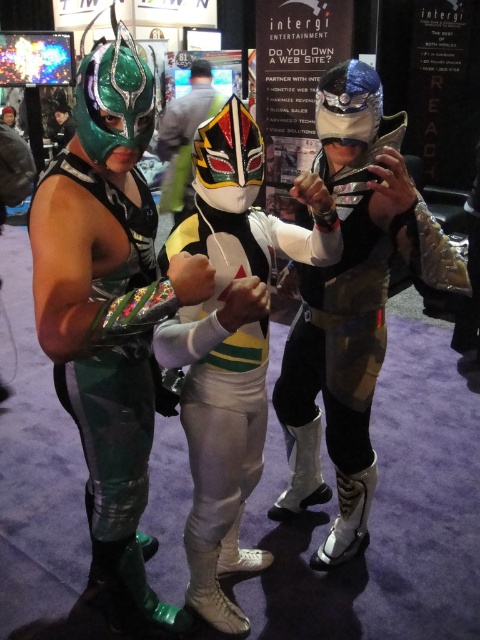
Does point (328, 93) come farther from viewer compared to point (211, 605)?

No, it is not.

Can you confirm if shiny silver armor at center is positioned to the left of white matte costume at center?

No, shiny silver armor at center is not to the left of white matte costume at center.

Is point (370, 228) in front of point (251, 173)?

No, (370, 228) is further to viewer.

This screenshot has width=480, height=640. In order to click on shiny silver armor at center in this screenshot , I will do `click(351, 304)`.

Can you confirm if green shiny suit at left is positioned below white glossy mask at center?

Correct, green shiny suit at left is located below white glossy mask at center.

Is green shiny suit at left taller than white glossy mask at center?

Incorrect, green shiny suit at left's height is not larger of white glossy mask at center's.

Which is in front, point (131, 228) or point (187, 144)?

Point (131, 228) is more forward.

Identify the location of green shiny suit at left. The image size is (480, 640). (113, 428).

Who is positioned more to the left, white matte costume at center or white glossy mask at center?

white glossy mask at center

Who is more distant from viewer, (177, 225) or (182, 131)?

Point (182, 131)

I want to click on white matte costume at center, so click(230, 344).